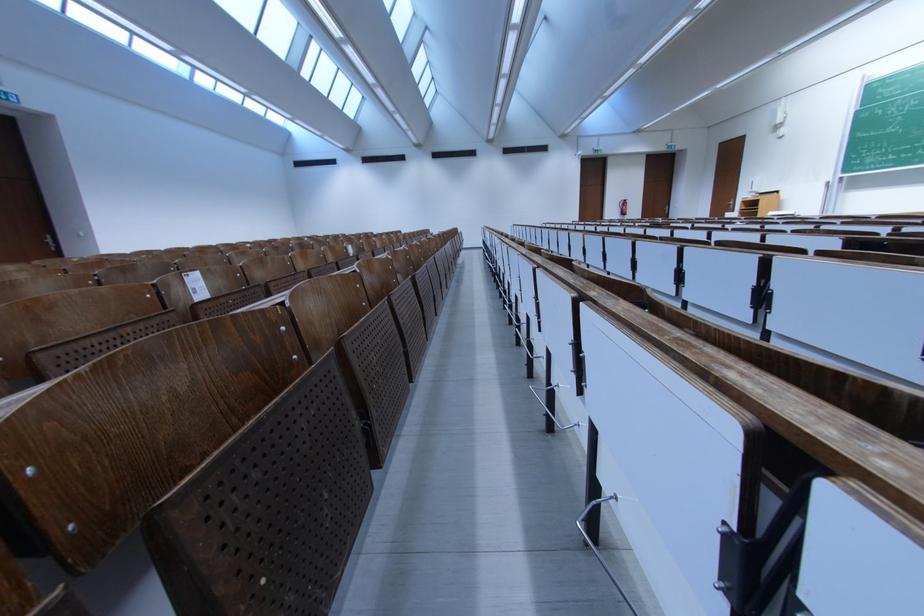
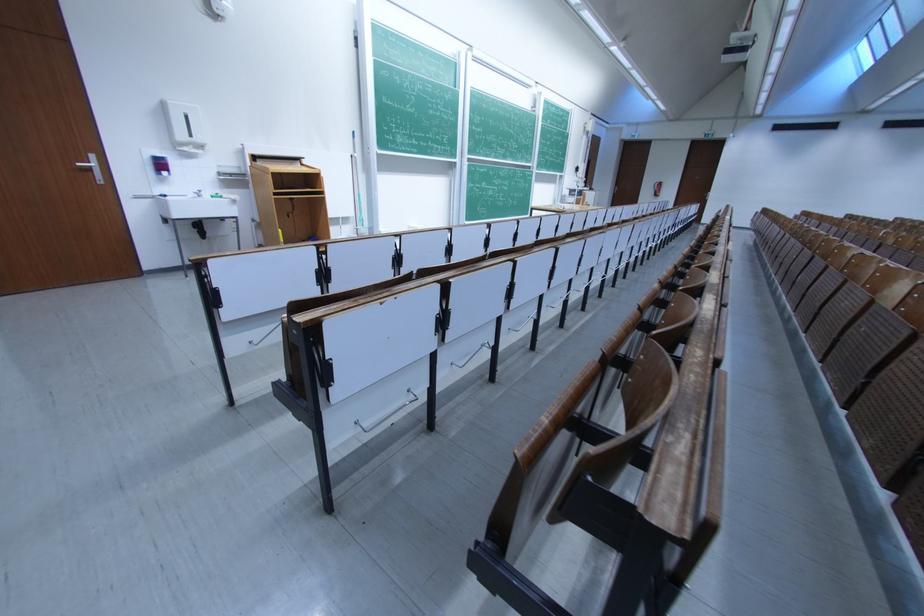
Locate, in the second image, the point that corresponds to [763,192] in the first image.

(205, 142)